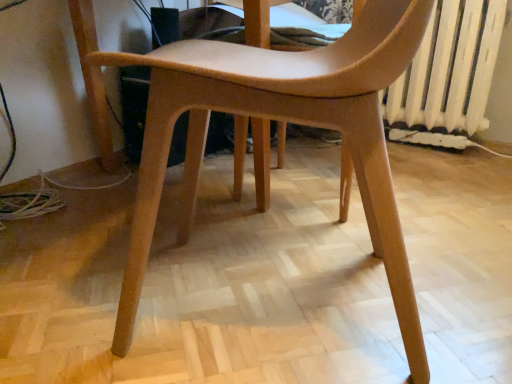
Image resolution: width=512 pixels, height=384 pixels. What do you see at coordinates (451, 68) in the screenshot? I see `white painted metal radiator at right` at bounding box center [451, 68].

This screenshot has height=384, width=512. I want to click on white painted metal radiator at right, so click(451, 68).

Locate an element on the screen. matte wood chair at center is located at coordinates (x=268, y=118).

What is the approximate width of matte wood chair at center?

The width of matte wood chair at center is 21.07 inches.

The height and width of the screenshot is (384, 512). Describe the element at coordinates (268, 118) in the screenshot. I see `matte wood chair at center` at that location.

Locate an element on the screen. This screenshot has width=512, height=384. white painted metal radiator at right is located at coordinates (451, 68).

Is white painted metal radiator at right at the left side of matte wood chair at center?

No.

Does white painted metal radiator at right come in front of matte wood chair at center?

No, it is behind matte wood chair at center.

Which is behind, point (469, 20) or point (146, 159)?

Positioned behind is point (469, 20).

From the image's perspective, is white painted metal radiator at right above matte wood chair at center?

Yes, from the image's perspective, white painted metal radiator at right is over matte wood chair at center.

From a real-world perspective, who is located lower, white painted metal radiator at right or matte wood chair at center?

matte wood chair at center is physically lower.

Does white painted metal radiator at right have a lesser width compared to matte wood chair at center?

Yes.

Does white painted metal radiator at right have a greater height compared to matte wood chair at center?

In fact, white painted metal radiator at right may be shorter than matte wood chair at center.

Considering the sizes of objects white painted metal radiator at right and matte wood chair at center in the image provided, who is bigger, white painted metal radiator at right or matte wood chair at center?

Bigger between the two is matte wood chair at center.

Which is correct: white painted metal radiator at right is inside matte wood chair at center, or outside of it?

white painted metal radiator at right is located beyond the bounds of matte wood chair at center.

Does white painted metal radiator at right touch matte wood chair at center?

No, white painted metal radiator at right is not making contact with matte wood chair at center.

Is white painted metal radiator at right facing away from matte wood chair at center?

No.

What's the angular difference between white painted metal radiator at right and matte wood chair at center's facing directions?

→ The facing directions of white painted metal radiator at right and matte wood chair at center are 68.5 degrees apart.

The width and height of the screenshot is (512, 384). Identify the location of radiator lying above the matte wood chair at center (from the image's perspective). (451, 68).

Is matte wood chair at center to the left or to the right of white painted metal radiator at right in the image?

From the image, it's evident that matte wood chair at center is to the left of white painted metal radiator at right.

Is matte wood chair at center in front of or behind white painted metal radiator at right in the image?

Visually, matte wood chair at center is located in front of white painted metal radiator at right.

Does point (415, 338) lie behind point (504, 8)?

No, it is not.

From the image's perspective, is matte wood chair at center over white painted metal radiator at right?

No, from the image's perspective, matte wood chair at center is not on top of white painted metal radiator at right.

From the picture: From a real-world perspective, who is located lower, matte wood chair at center or white painted metal radiator at right?

From a 3D spatial view, matte wood chair at center is below.

Which object is wider, matte wood chair at center or white painted metal radiator at right?

matte wood chair at center.

In the scene shown: In terms of height, does matte wood chair at center look taller or shorter compared to white painted metal radiator at right?

Clearly, matte wood chair at center is taller compared to white painted metal radiator at right.

Can you confirm if matte wood chair at center is smaller than white painted metal radiator at right?

Incorrect, matte wood chair at center is not smaller in size than white painted metal radiator at right.

Can white painted metal radiator at right be found inside matte wood chair at center?

No, white painted metal radiator at right is not a part of matte wood chair at center.

Is matte wood chair at center next to white painted metal radiator at right?

There is a gap between matte wood chair at center and white painted metal radiator at right.

Could you tell me if matte wood chair at center is turned towards white painted metal radiator at right?

No.

Identify the location of radiator to the right of matte wood chair at center. The image size is (512, 384). (451, 68).

Where is `radiator above the matte wood chair at center (from the image's perspective)`? This screenshot has height=384, width=512. radiator above the matte wood chair at center (from the image's perspective) is located at coordinates (451, 68).

Locate an element on the screen. Image resolution: width=512 pixels, height=384 pixels. radiator to the right of matte wood chair at center is located at coordinates (451, 68).